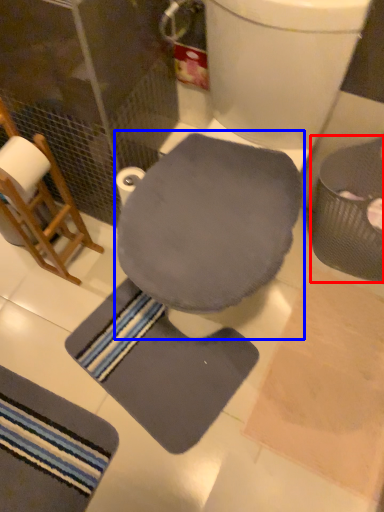
Question: Which point is closer to the camera, potty (highlighted by a red box) or swivel chair (highlighted by a blue box)?

Choices:
 (A) potty
 (B) swivel chair

Answer: (B)